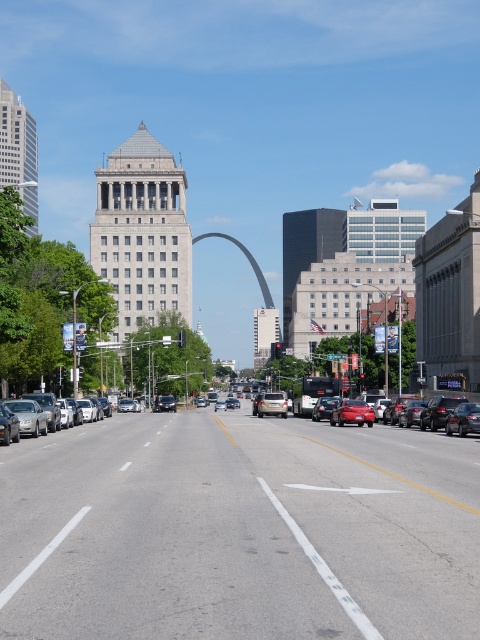
Who is more forward, (257, 406) or (134, 410)?

Positioned in front is point (257, 406).

Can you confirm if silver metallic suv at center is positioned below silver metallic sedan at center?

No.

You are a GUI agent. You are given a task and a screenshot of the screen. Output one action in this format:
    pyautogui.click(x=<x>, y=<y>)
    Task: Click on the silver metallic suv at center
    This screenshot has width=480, height=640.
    Given the screenshot: What is the action you would take?
    pyautogui.click(x=269, y=404)

Image resolution: width=480 pixels, height=640 pixels. I want to click on silver metallic suv at center, so click(269, 404).

Consider the image. Does shiny black sedan at right have a greater width compared to matte silver sedan at center?

No, shiny black sedan at right is not wider than matte silver sedan at center.

Does point (459, 406) come behind point (224, 406)?

No, (459, 406) is in front of (224, 406).

Which is in front, point (463, 410) or point (216, 403)?

Point (463, 410)

The height and width of the screenshot is (640, 480). Find the location of `shiny black sedan at right`. shiny black sedan at right is located at coordinates (464, 419).

Based on the photo, who is higher up, silver metallic suv at center or matte silver sedan at center?

silver metallic suv at center

Is silver metallic suv at center shorter than matte silver sedan at center?

No.

Image resolution: width=480 pixels, height=640 pixels. Identify the location of silver metallic suv at center. (269, 404).

The height and width of the screenshot is (640, 480). Find the location of `silver metallic suv at center`. silver metallic suv at center is located at coordinates click(269, 404).